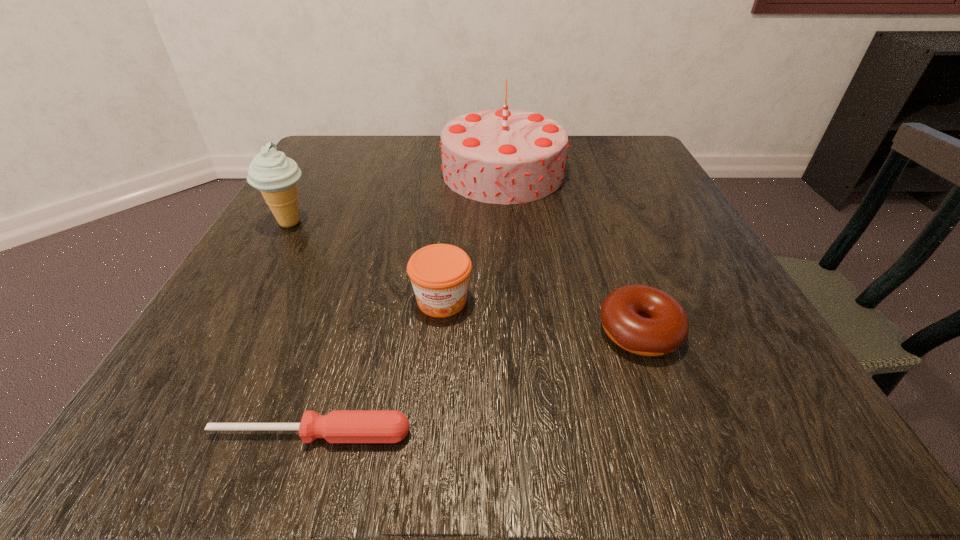
Locate an element on the screen. Image resolution: width=960 pixels, height=540 pixels. empty space that is in between the birthday cake and the second tallest object is located at coordinates (396, 198).

Where is `free space between the second shortest object and the screwdriver`? free space between the second shortest object and the screwdriver is located at coordinates (475, 383).

At what (x,y) coordinates should I click in order to perform the action: click on blank region between the jam and the screwdriver. Please return your answer as a coordinate pair (x, y). The height and width of the screenshot is (540, 960). Looking at the image, I should click on (376, 367).

I want to click on vacant area between the screwdriver and the tallest object, so click(x=407, y=303).

Locate an element on the screen. object that stands as the closest to the jam is located at coordinates (339, 426).

The width and height of the screenshot is (960, 540). What are the coordinates of `object that is the second closest one to the leftmost object` in the screenshot? It's located at (439, 273).

The image size is (960, 540). I want to click on vacant area that satisfies the following two spatial constraints: 1. on the front side of the farthest object; 2. on the right side of the fourth tallest object, so click(x=516, y=332).